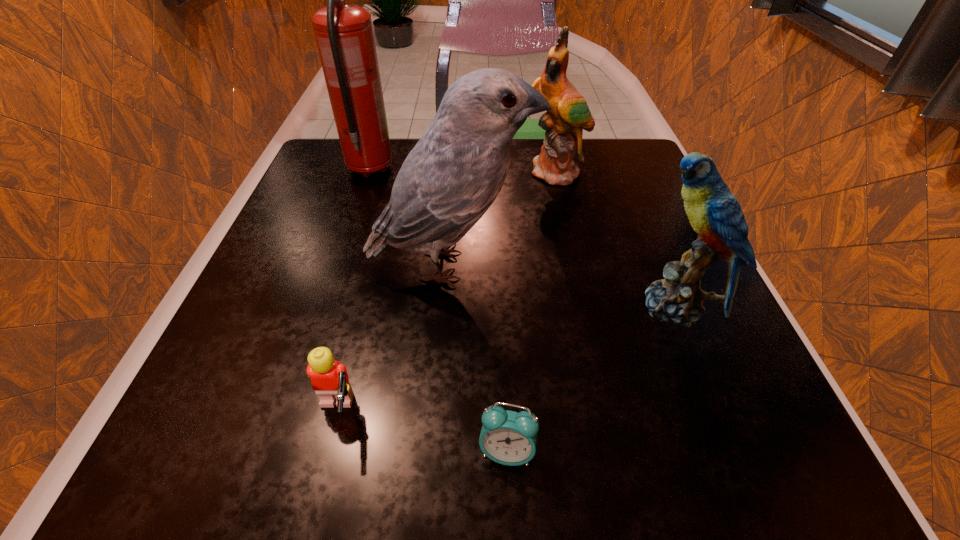
Where is `fire extinguisher`? The width and height of the screenshot is (960, 540). fire extinguisher is located at coordinates (344, 34).

Where is `the leftmost parrot`? The image size is (960, 540). the leftmost parrot is located at coordinates (451, 177).

You are a GUI agent. You are given a task and a screenshot of the screen. Output one action in this format:
    pyautogui.click(x=<x>, y=<y>)
    Task: Click on the second parrot from right to left
    This screenshot has width=960, height=540.
    Given the screenshot: What is the action you would take?
    pyautogui.click(x=562, y=148)

I want to click on the farthest parrot, so click(562, 148).

Where is `the rightmost parrot`? The height and width of the screenshot is (540, 960). the rightmost parrot is located at coordinates (714, 213).

Find the location of `the shortest parrot`. the shortest parrot is located at coordinates (714, 213).

You are a GUI agent. You are given a task and a screenshot of the screen. Output one action in this format:
    pyautogui.click(x=<x>, y=<y>)
    Task: Click on the Lego
    This screenshot has height=540, width=960.
    Given the screenshot: What is the action you would take?
    pyautogui.click(x=329, y=378)

You are a GUI agent. You are given a task and a screenshot of the screen. Output one action in this format:
    pyautogui.click(x=<x>, y=<y>)
    Task: Click on the shortest object
    
    Given the screenshot: What is the action you would take?
    pyautogui.click(x=507, y=437)

This screenshot has height=540, width=960. I want to click on vacant area situated on the handle side the fire extinguisher, so click(380, 139).

This screenshot has width=960, height=540. What are the coordinates of `free space located on the front-facing side of the leftmost parrot` in the screenshot? It's located at point(595,266).